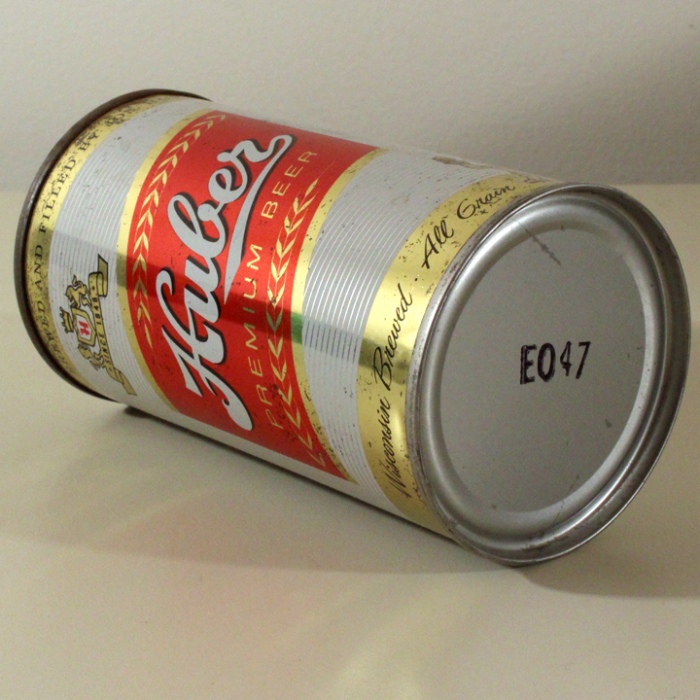
Find the location of a particular element. cream colored table is located at coordinates (245, 536).